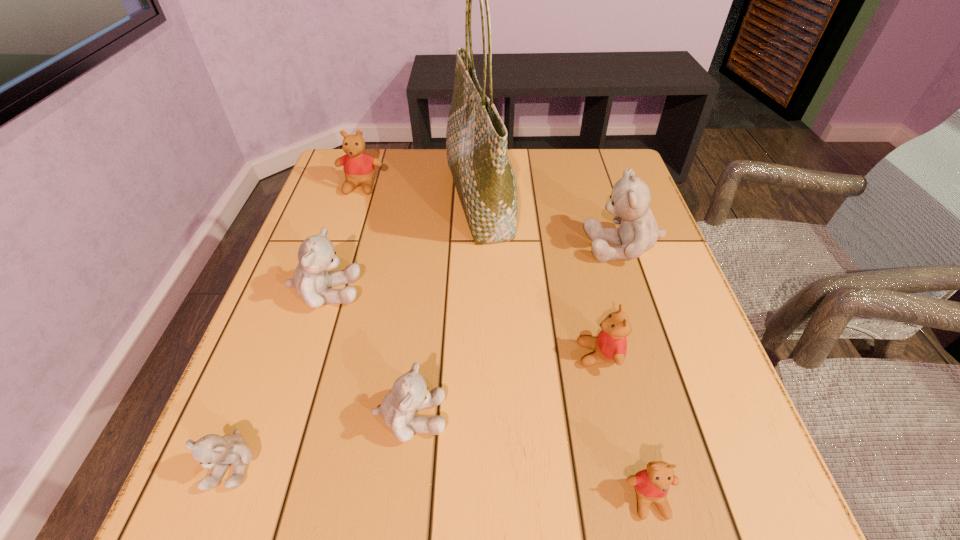
Where is `vacant space at the near edge of the desktop`? vacant space at the near edge of the desktop is located at coordinates pyautogui.click(x=525, y=510).

The image size is (960, 540). In the image, there is a desktop. Find the location of `vacant space at the left edge`. vacant space at the left edge is located at coordinates (309, 224).

You are a GUI agent. You are given a task and a screenshot of the screen. Output one action in this format:
    pyautogui.click(x=<x>, y=<y>)
    Task: Click on the vacant space at the right edge of the desktop
    
    Given the screenshot: What is the action you would take?
    (x=717, y=374)

Image resolution: width=960 pixels, height=540 pixels. What are the coordinates of `vacant space at the near left corner` in the screenshot? It's located at (192, 523).

Locate an element on the screen. This screenshot has width=960, height=540. free space at the far right corner of the desktop is located at coordinates (614, 174).

The height and width of the screenshot is (540, 960). What are the coordinates of `free space between the third biggest gray teddy bear and the rightmost gray teddy bear` in the screenshot? It's located at (516, 332).

Where is `empty space between the biggest gray teddy bear and the second smallest gray teddy bear`? empty space between the biggest gray teddy bear and the second smallest gray teddy bear is located at coordinates (516, 332).

Where is `empty location between the fourth teddy bear from right to left and the farthest gray teddy bear`? Image resolution: width=960 pixels, height=540 pixels. empty location between the fourth teddy bear from right to left and the farthest gray teddy bear is located at coordinates (516, 332).

The height and width of the screenshot is (540, 960). I want to click on free space between the third smallest gray teddy bear and the green shopping bag, so click(x=402, y=246).

The height and width of the screenshot is (540, 960). I want to click on empty space between the biggest gray teddy bear and the third gray teddy bear from left to right, so click(x=516, y=332).